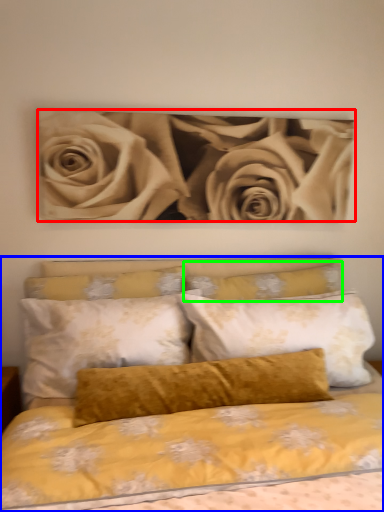
Question: Which is nearer to the rose (highlighted by a red box)? bed (highlighted by a blue box) or pillow (highlighted by a green box).

Choices:
 (A) bed
 (B) pillow

Answer: (B)